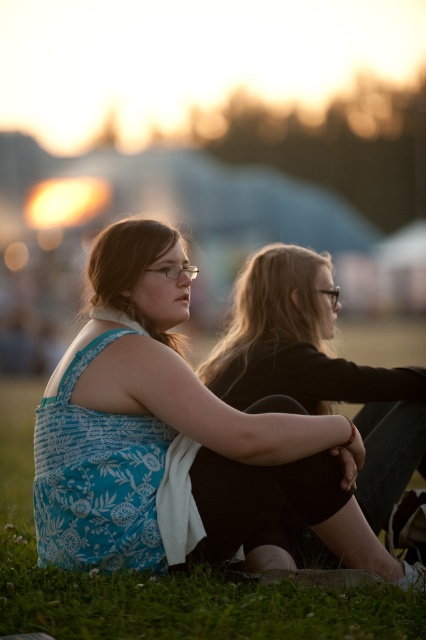
You are a photographer trying to capture a photo of the two people in the scene. You notice the green grass at lower center and the matte black hair at center. Which object is located more to the left in the frame?

The green grass at lower center is positioned more to the left than the matte black hair at center according to the description.

You are a photographer trying to capture a photo of the green grass at lower center and the matte black hair at center. Which object is closer to the camera lens?

The matte black hair at center is closer to the camera lens because the green grass at lower center is positioned under it, indicating it is behind.

You are standing at the center of the image and want to sit down on the green grass at lower center. Which direction should you move to reach it?

The green grass at lower center is located at point (x=161, y=579), so you should move downward and slightly to the right from the center to reach it.